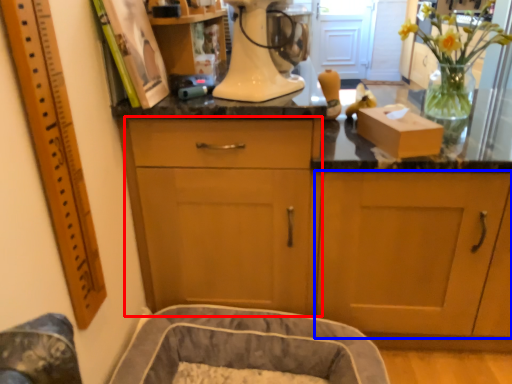
Question: Which of the following is the closest to the observer, cabinetry (highlighted by a red box) or cabinetry (highlighted by a blue box)?

Choices:
 (A) cabinetry
 (B) cabinetry

Answer: (A)